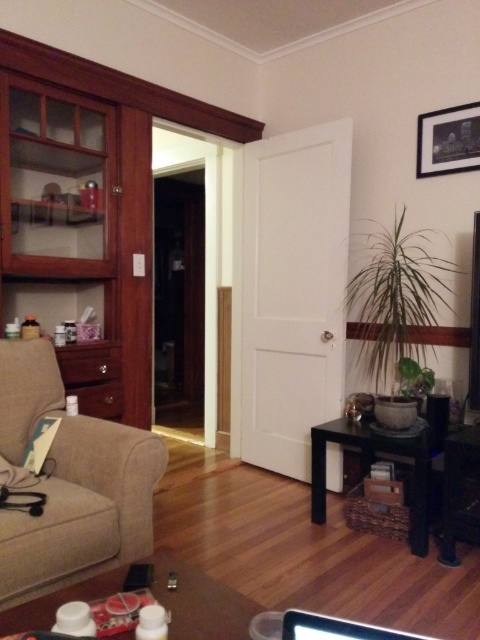
Can you confirm if beige fabric armchair at left is wider than matte black picture frame at upper right?

Yes, beige fabric armchair at left is wider than matte black picture frame at upper right.

Where is `beige fabric armchair at left`? beige fabric armchair at left is located at coordinates (71, 483).

Who is lower down, beige fabric armchair at left or black glossy cabinet at lower right?

Positioned lower is black glossy cabinet at lower right.

Looking at this image, is beige fabric armchair at left closer to camera compared to black glossy cabinet at lower right?

Yes, it is.

Where is `beige fabric armchair at left`? This screenshot has width=480, height=640. beige fabric armchair at left is located at coordinates (71, 483).

Find the location of `beige fabric armchair at left`. beige fabric armchair at left is located at coordinates (71, 483).

Who is taller, black glossy cabinet at lower right or matte black picture frame at upper right?

Standing taller between the two is black glossy cabinet at lower right.

This screenshot has height=640, width=480. Describe the element at coordinates (459, 492) in the screenshot. I see `black glossy cabinet at lower right` at that location.

The height and width of the screenshot is (640, 480). What do you see at coordinates (459, 492) in the screenshot?
I see `black glossy cabinet at lower right` at bounding box center [459, 492].

Where is `black glossy cabinet at lower right`? The width and height of the screenshot is (480, 640). black glossy cabinet at lower right is located at coordinates (459, 492).